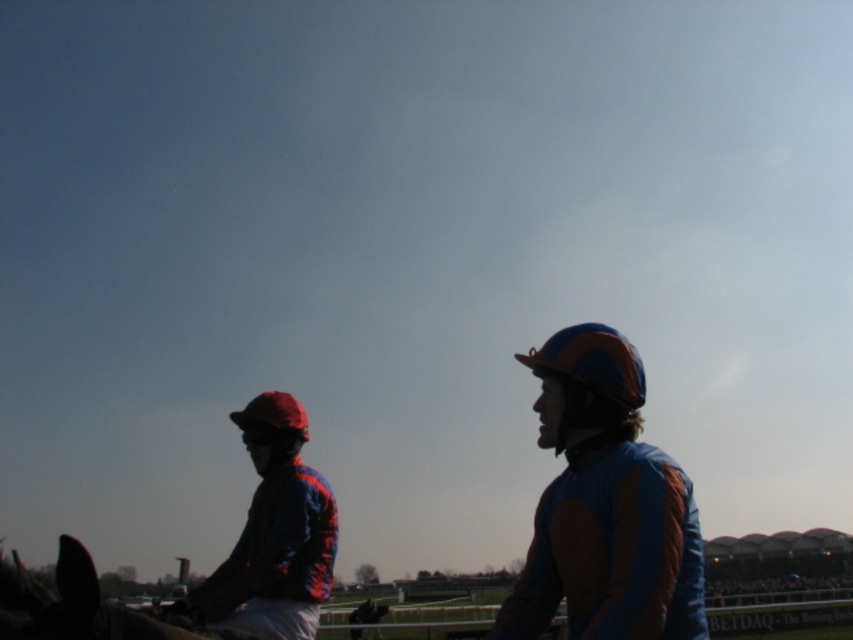
You are a photographer at the horse racing event. You need to capture a photo where the shiny blue and orange jockey suit at center and the blue matte helmet at center are both visible. Based on their heights, which object should you focus on first to ensure both are in frame?

Since the shiny blue and orange jockey suit at center is shorter than the blue matte helmet at center, you should focus on the blue matte helmet at center first to ensure both are in frame.

You are a photographer at the horse racing event. You want to capture a closeup shot of the blue matte helmet at center and the shiny blue fabric jockey at left. Which object should you zoom in on to get a larger image in your photo?

The shiny blue fabric jockey at left is larger than the blue matte helmet at center, so zooming in on the shiny blue fabric jockey at left will result in a larger image in the photo.

You are a photographer at the horse racing event. You want to take a photo of the shiny blue and orange jockey suit at center. Where should you aim your camera?

You should aim your camera at point 0.710 on the vertical axis and point 0.791 on the horizontal axis to capture the shiny blue and orange jockey suit at center.